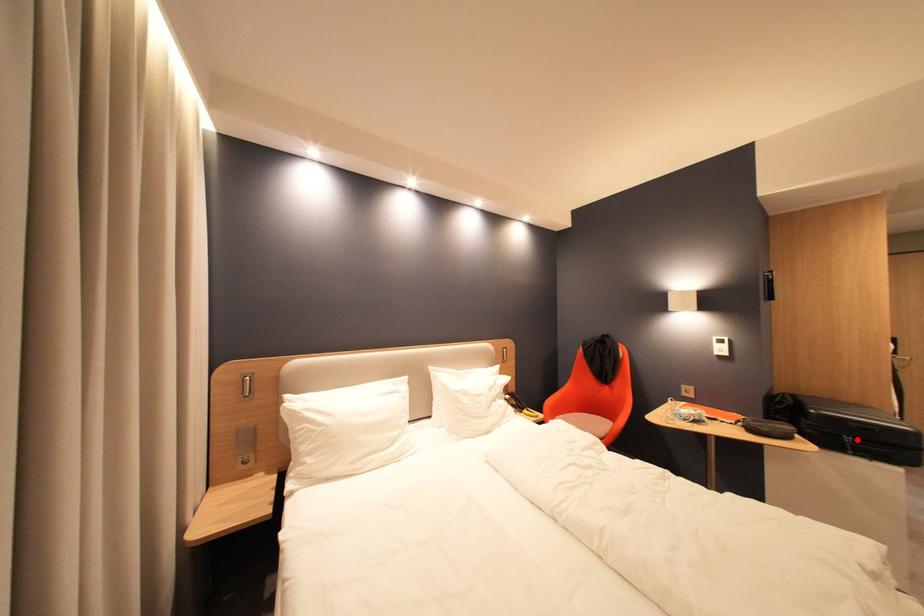
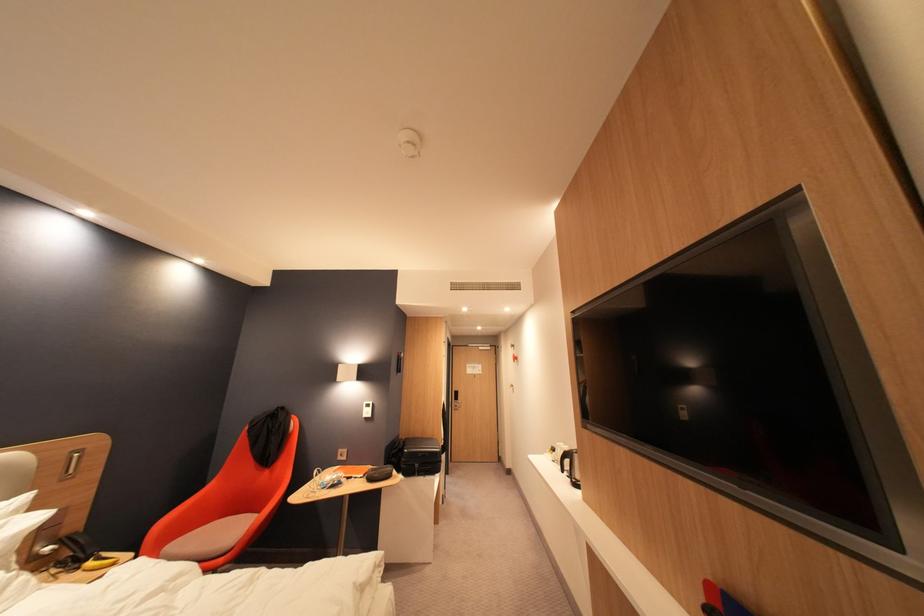
The point at the highlighted location is marked in the first image. Where is the corresponding point in the second image?

(427, 467)